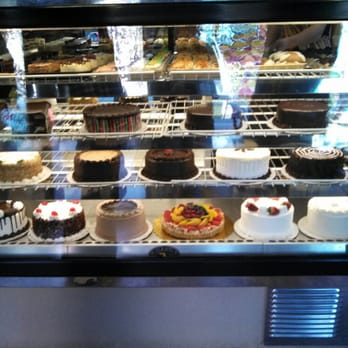
I want to click on glass, so click(188, 86).